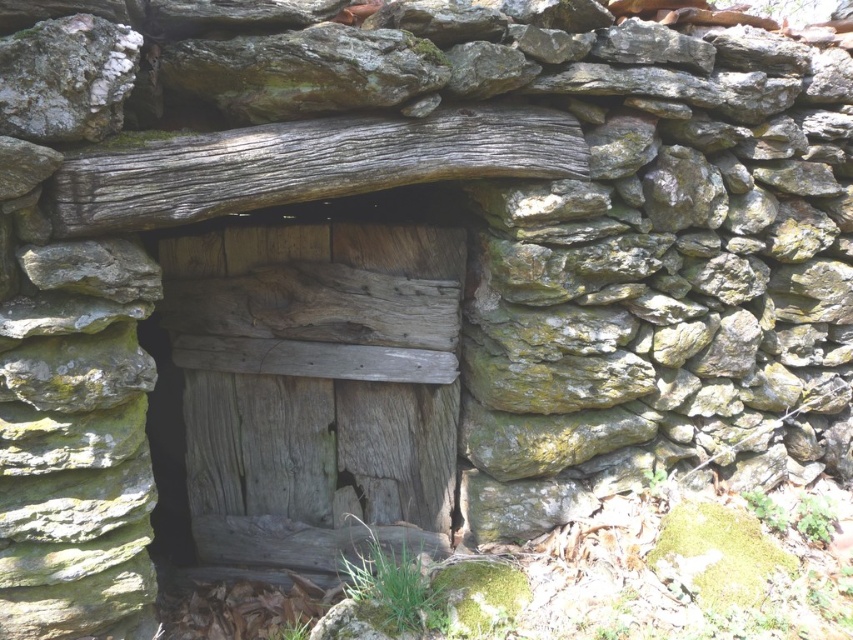
Question: Which of the following is the closest to the observer?

Choices:
 (A) (61, 72)
 (B) (430, 417)
 (C) (294, 192)

Answer: (A)

Question: Based on their relative distances, which object is nearer to the weathered wood log at center?

Choices:
 (A) speckled gray rock at upper left
 (B) weathered wood door at center

Answer: (A)

Question: Is weathered wood door at center to the left of speckled gray rock at upper left from the viewer's perspective?

Choices:
 (A) no
 (B) yes

Answer: (A)

Question: In this image, where is weathered wood log at center located relative to speckled gray rock at upper left?

Choices:
 (A) below
 (B) above

Answer: (A)

Question: Is weathered wood door at center below speckled gray rock at upper left?

Choices:
 (A) no
 (B) yes

Answer: (B)

Question: Which object is closer to the camera taking this photo?

Choices:
 (A) weathered wood door at center
 (B) speckled gray rock at upper left

Answer: (B)